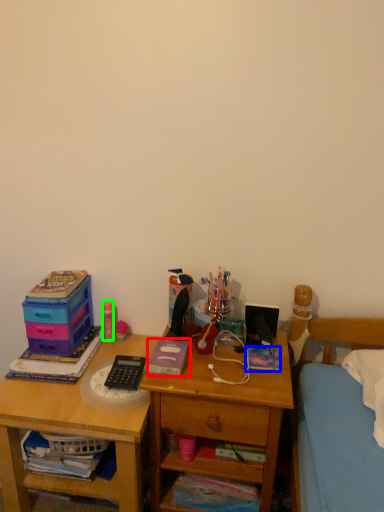
Question: Which object is positioned closest to book (highlighted by a red box)? Select from book (highlighted by a blue box) and stationery (highlighted by a green box).

Choices:
 (A) book
 (B) stationery

Answer: (A)